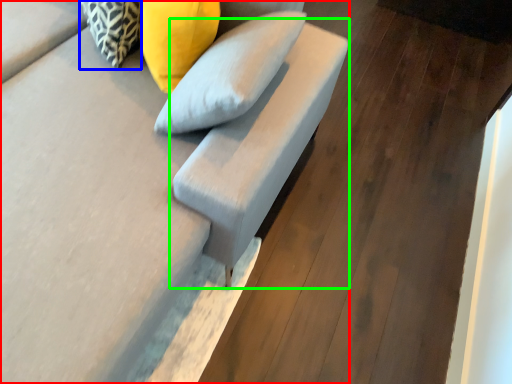
Question: Based on their relative distances, which object is farther from furniture (highlighted by a red box)? Choose from pillow (highlighted by a blue box) and armchair (highlighted by a green box).

Choices:
 (A) pillow
 (B) armchair

Answer: (A)